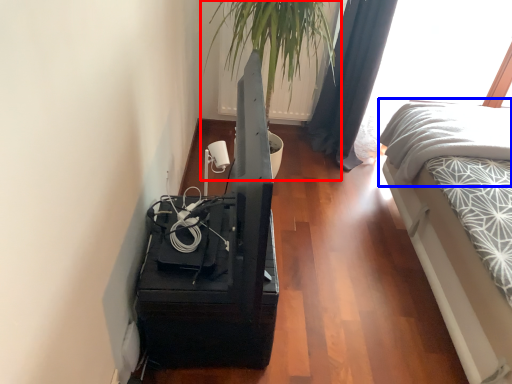
Question: Among these objects, which one is nearest to the camera, houseplant (highlighted by a red box) or bedding (highlighted by a blue box)?

Choices:
 (A) houseplant
 (B) bedding

Answer: (A)